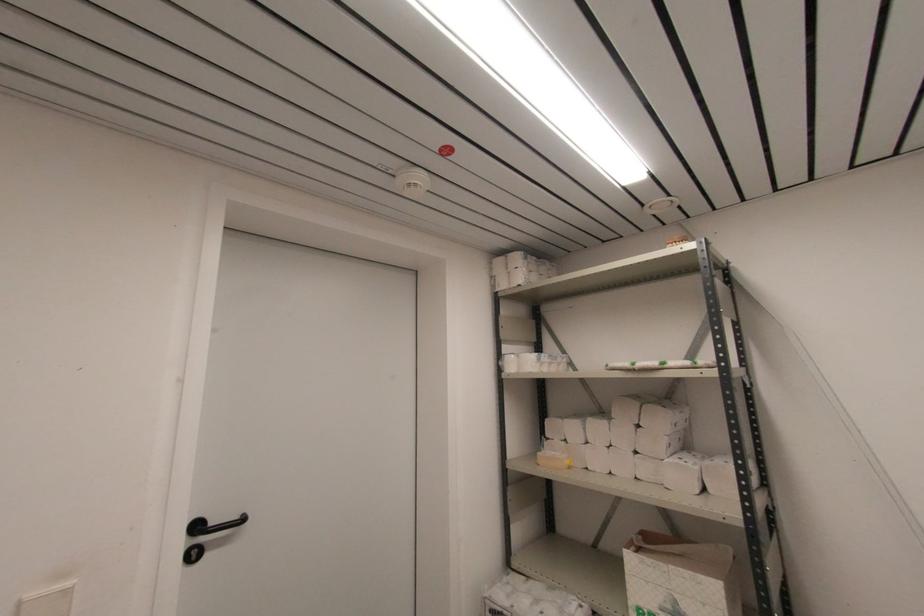
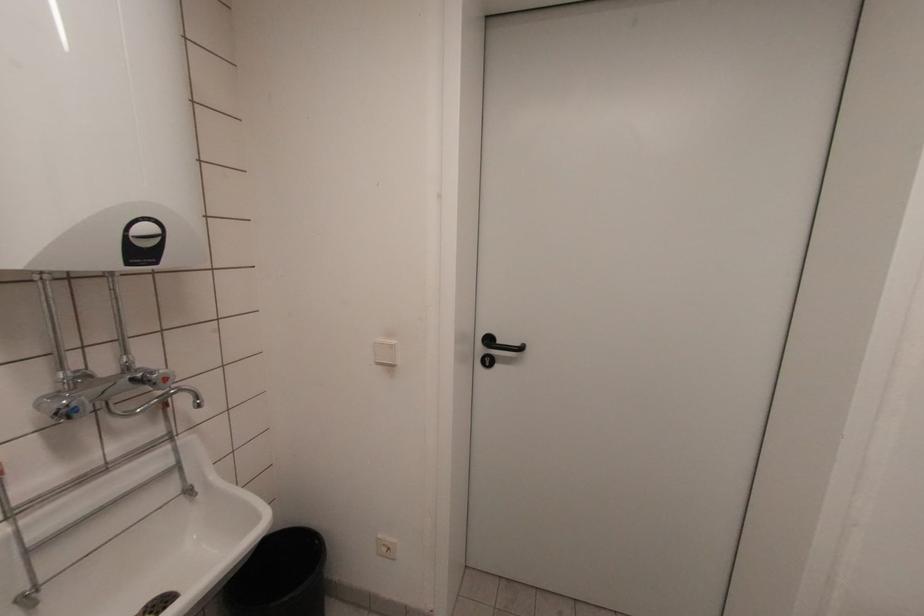
Where in the second image is the point corresponding to the point at 196,557 from the first image?

(488, 363)